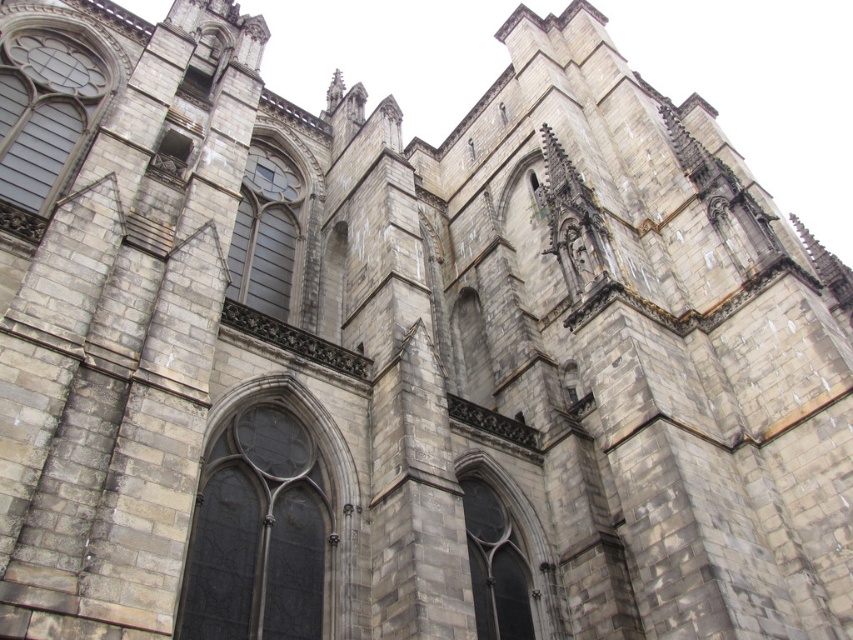
You are an architect examining the cathedral facade. You notice the dark glass window at center and the gray stone window at center. Which one is positioned lower on the facade?

The dark glass window at center is located below the gray stone window at center, so it is positioned lower on the facade.

Based on the photo, you are standing in front of the cathedral and notice a point marked at coordinates (265,232). Based on the scene description, what architectural feature is located at this point?

The point at coordinates (265,232) marks the gray stone window at center.